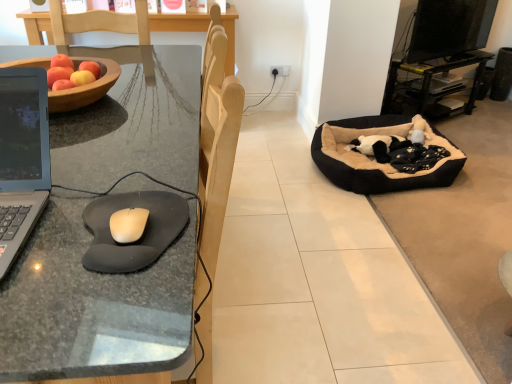
Image resolution: width=512 pixels, height=384 pixels. Identify the location of free space behind white matte mouse at left. (142, 176).